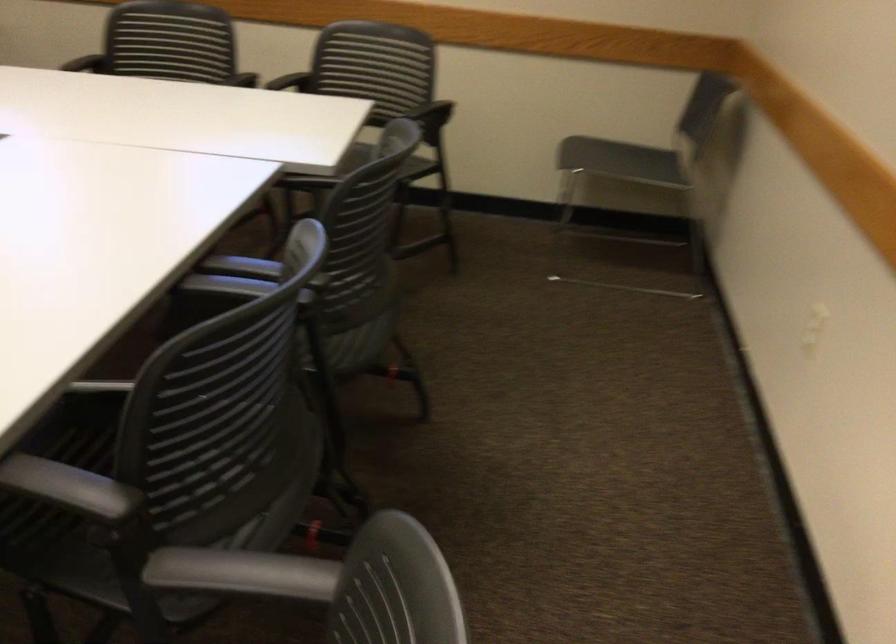
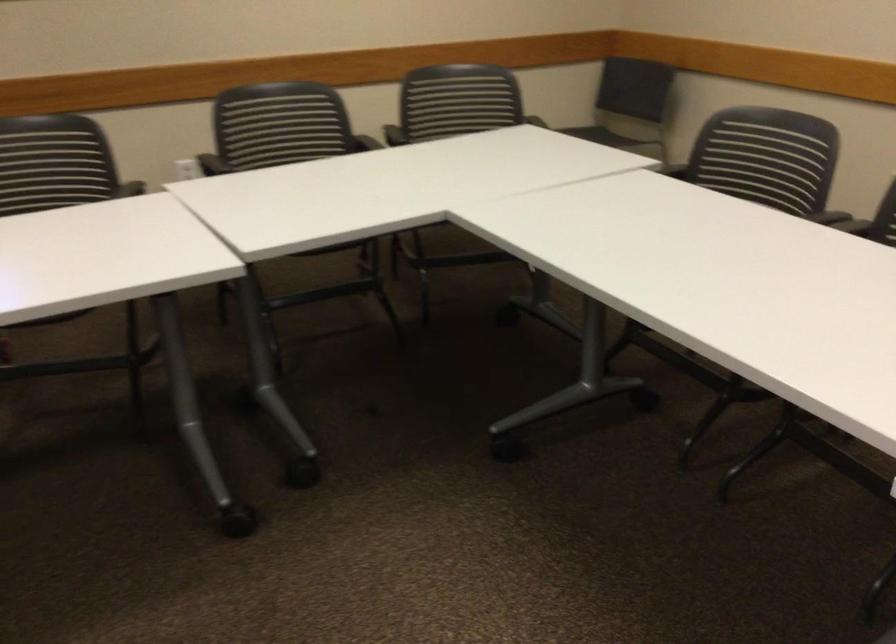
Question: I am providing you with two images of the same scene from different viewpoints. Please identify which objects are invisible in image2.

Choices:
 (A) chair sitting surface
 (B) shower head lever
 (C) black chair sitting surface
 (D) black chair armrest

Answer: (A)